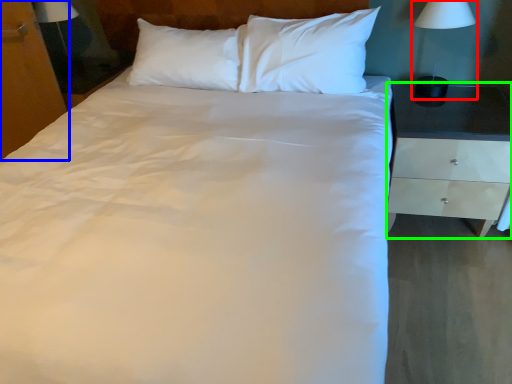
Question: Which object is positioned closest to bedside lamp (highlighted by a red box)? Select from dresser (highlighted by a blue box) and nightstand (highlighted by a green box).

Choices:
 (A) dresser
 (B) nightstand

Answer: (B)